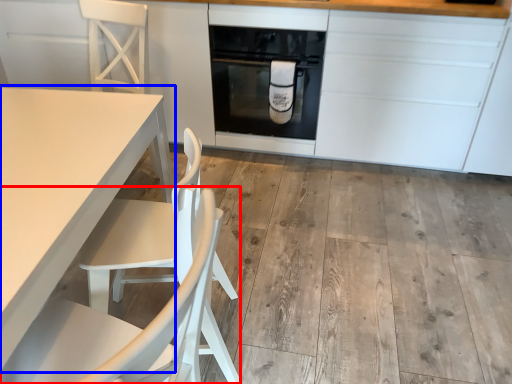
Question: Among these objects, which one is nearest to the camera, chair (highlighted by a red box) or table (highlighted by a blue box)?

Choices:
 (A) chair
 (B) table

Answer: (A)